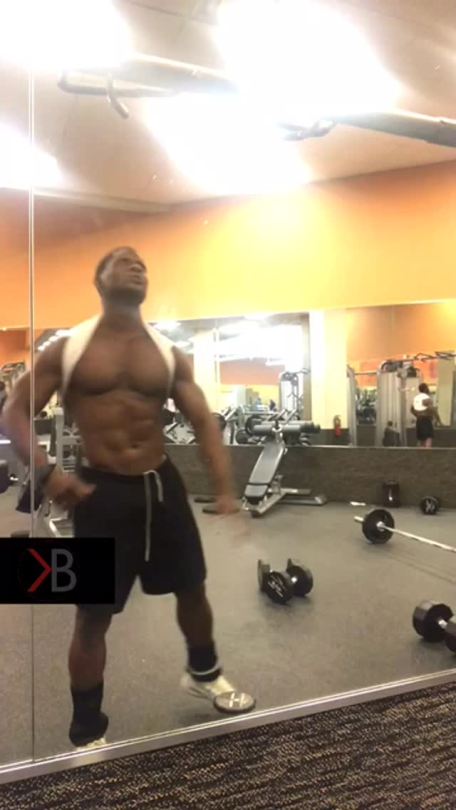
At what (x,y) coordinates should I click in order to perform the action: click on floor. Please return your answer as a coordinate pair (x, y). This screenshot has width=456, height=810. Looking at the image, I should click on (285, 676).